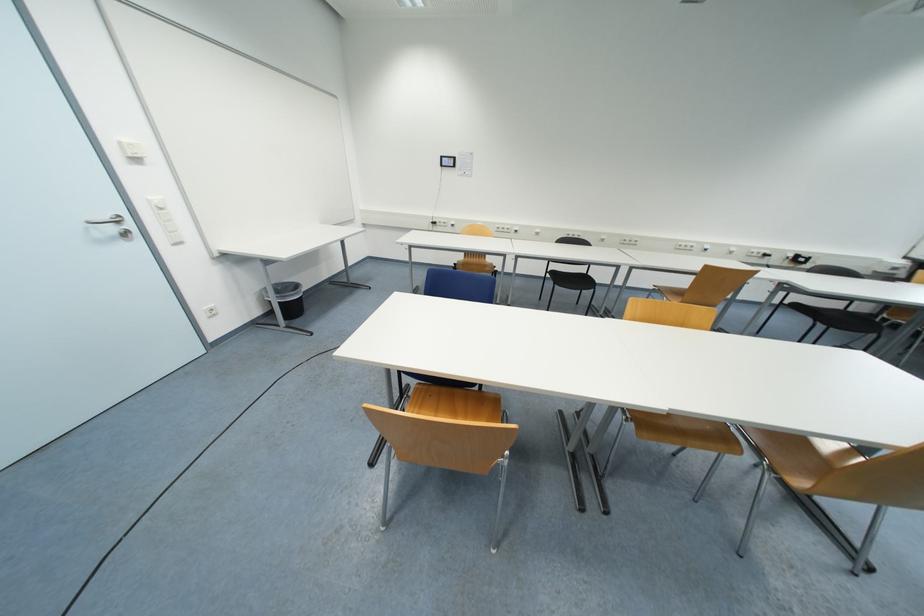
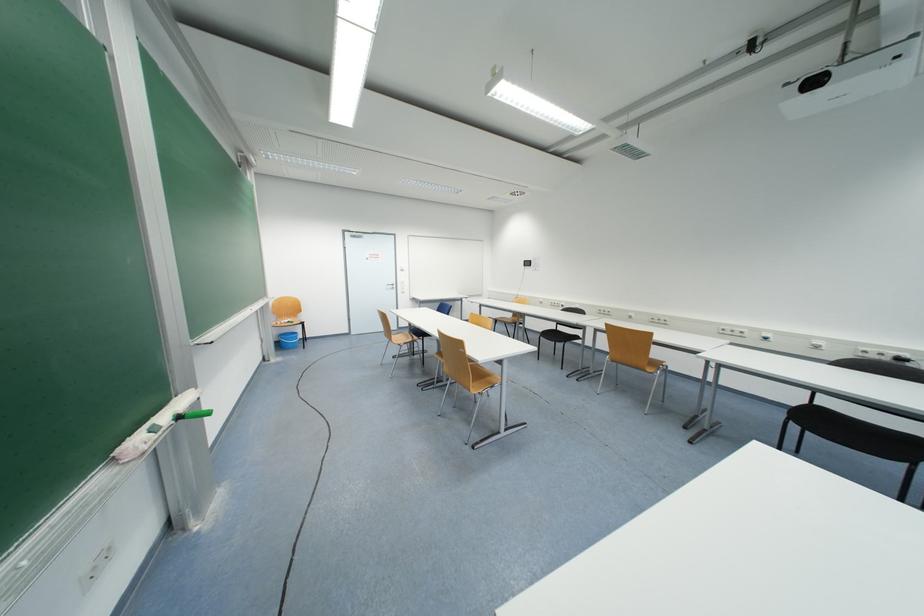
Question: I am providing you with two images of the same scene from different viewpoints. Please identify which objects are invisible in image2.

Choices:
 (A) silver door handle
 (B) green handle squeegee
 (C) black trash can
 (D) crumpled paper

Answer: (C)